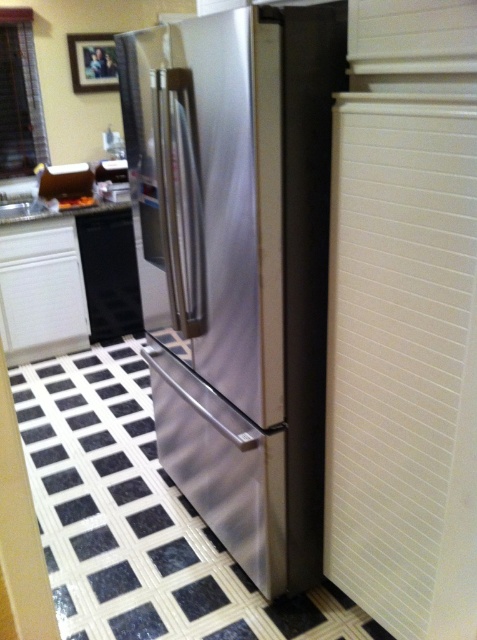
Question: Is stainless steel refrigerator at center closer to the viewer compared to black matte dishwasher at lower left?

Choices:
 (A) no
 (B) yes

Answer: (B)

Question: Which of the following is the farthest from the observer?

Choices:
 (A) (279, 48)
 (B) (101, 266)

Answer: (B)

Question: Which point is closer to the camera?

Choices:
 (A) black matte dishwasher at lower left
 (B) stainless steel refrigerator at center

Answer: (B)

Question: Can you confirm if stainless steel refrigerator at center is thinner than black matte dishwasher at lower left?

Choices:
 (A) no
 (B) yes

Answer: (A)

Question: Which point is closer to the camera?

Choices:
 (A) stainless steel refrigerator at center
 (B) black matte dishwasher at lower left

Answer: (A)

Question: Is stainless steel refrigerator at center above black matte dishwasher at lower left?

Choices:
 (A) no
 (B) yes

Answer: (A)